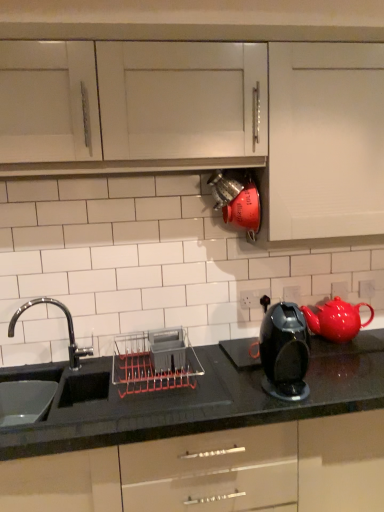
Question: Is red glossy teapot at right taller than white matte cabinet at upper right?

Choices:
 (A) yes
 (B) no

Answer: (B)

Question: Does red glossy teapot at right touch white matte cabinet at upper right?

Choices:
 (A) yes
 (B) no

Answer: (B)

Question: Is white matte cabinet at upper right located within red glossy teapot at right?

Choices:
 (A) no
 (B) yes

Answer: (A)

Question: From the image's perspective, is red glossy teapot at right above white matte cabinet at upper right?

Choices:
 (A) yes
 (B) no

Answer: (B)

Question: Is the position of red glossy teapot at right more distant than that of white matte cabinet at upper right?

Choices:
 (A) yes
 (B) no

Answer: (A)

Question: From a real-world perspective, is black glossy countertop at lower center physically located above or below white matte cabinet at upper right?

Choices:
 (A) above
 (B) below

Answer: (B)

Question: Considering the positions of black glossy countertop at lower center and white matte cabinet at upper right in the image, is black glossy countertop at lower center wider or thinner than white matte cabinet at upper right?

Choices:
 (A) wide
 (B) thin

Answer: (A)

Question: In the image, is black glossy countertop at lower center on the left side or the right side of white matte cabinet at upper right?

Choices:
 (A) left
 (B) right

Answer: (A)

Question: Is black glossy countertop at lower center bigger or smaller than white matte cabinet at upper right?

Choices:
 (A) small
 (B) big

Answer: (B)

Question: Looking at the image, does glossy black coffee maker at center-right seem bigger or smaller compared to gray plastic dish rack at center?

Choices:
 (A) small
 (B) big

Answer: (A)

Question: Does point (301, 364) appear closer or farther from the camera than point (145, 351)?

Choices:
 (A) farther
 (B) closer

Answer: (B)

Question: From a real-world perspective, is glossy black coffee maker at center-right above or below gray plastic dish rack at center?

Choices:
 (A) above
 (B) below

Answer: (A)

Question: Relative to gray plastic dish rack at center, is glossy black coffee maker at center-right in front or behind?

Choices:
 (A) front
 (B) behind

Answer: (A)

Question: From the image's perspective, is red glossy teapot at right above or below glossy black coffee maker at center-right?

Choices:
 (A) above
 (B) below

Answer: (A)

Question: Is red glossy teapot at right bigger or smaller than glossy black coffee maker at center-right?

Choices:
 (A) small
 (B) big

Answer: (B)